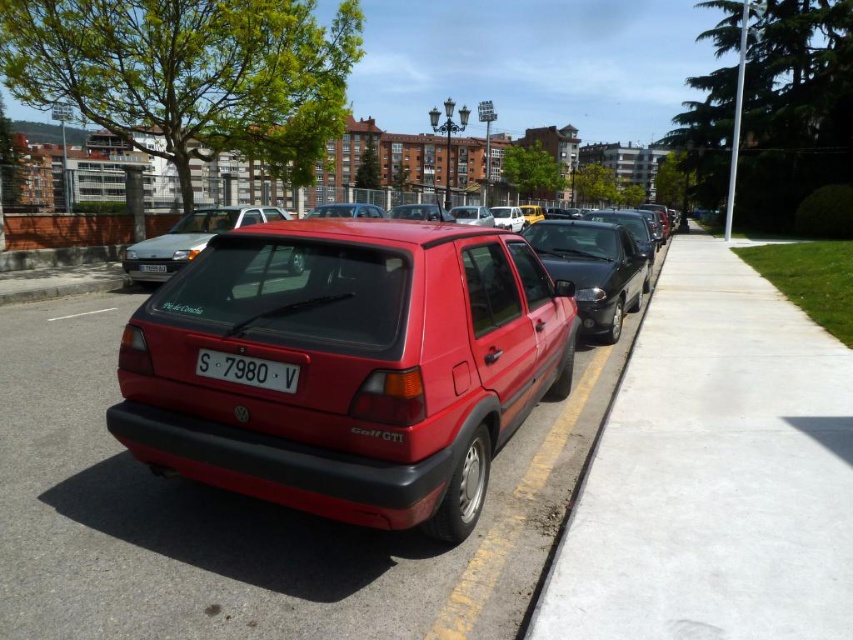
You are a delivery person trying to park your vehicle between the smooth concrete pavement at center and the satin silver hatchback at center. Can you fit your vehicle if it is 1.8 meters wide?

The smooth concrete pavement at center has a lesser width compared to the satin silver hatchback at center. Since the pavement is narrower than the hatchback, but the exact width of the pavement isn t provided, we can infer that if the hatchback is wider than 1.8 meters, the pavement might be too narrow. However, without specific measurements, it s uncertain. Please check the actual space.

You are a delivery person trying to park your vehicle between the smooth concrete pavement at center and the satin silver hatchback at center. Can you fit your vehicle if it requires 2 meters of space?

The smooth concrete pavement at center is shorter than the satin silver hatchback at center, but the description does not provide specific measurements about the available space between them. Therefore, it is unclear if there is enough space to fit a vehicle requiring 2 meters.

You are standing at the lamppost and want to walk to the red Volkswagen Golf GTI. There are two points marked in the parking area. Which point should you go through first, point (x=648, y=301) or point (x=199, y=372)?

You should go through point (x=199, y=372) first because point (x=648, y=301) is behind it.